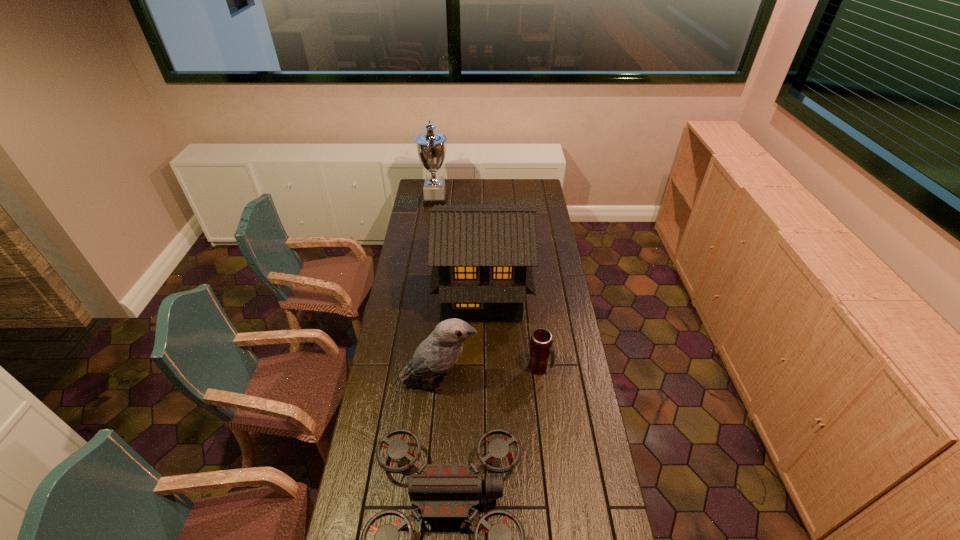
Locate an element on the screen. This screenshot has width=960, height=540. trophy cup is located at coordinates (431, 147).

The height and width of the screenshot is (540, 960). I want to click on the fourth nearest object, so click(481, 256).

In order to click on the third shortest object in this screenshot , I will do `click(436, 354)`.

In order to click on the fourth tallest object in this screenshot , I will do `click(541, 341)`.

At what (x,y) coordinates should I click in order to perform the action: click on free space located at the front view of the farthest object. Please return your answer as a coordinate pair (x, y). This screenshot has height=540, width=960. Looking at the image, I should click on (502, 201).

I want to click on vacant area located 0.190m on the front-facing side of the dollhouse, so [483, 364].

The width and height of the screenshot is (960, 540). I want to click on vacant space positioned on the front-facing side of the third tallest object, so click(517, 382).

In order to click on vacant space located 0.130m on the side with the handle of the thermos bottle in this screenshot , I will do `click(583, 368)`.

The height and width of the screenshot is (540, 960). I want to click on object that is at the far edge, so click(431, 147).

Locate an element on the screen. The width and height of the screenshot is (960, 540). trophy cup that is at the left edge is located at coordinates (431, 147).